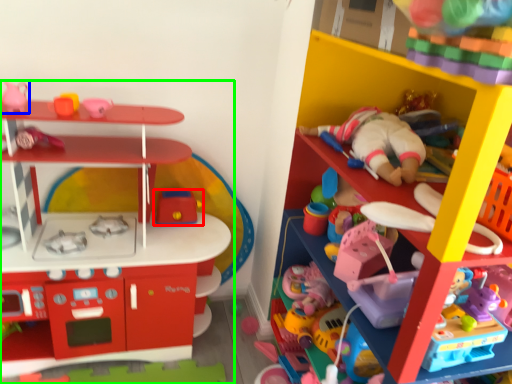
Question: Based on their relative distances, which object is nearer to toy (highlighted by a red box)? Choose from toy (highlighted by a blue box) and toy (highlighted by a green box).

Choices:
 (A) toy
 (B) toy

Answer: (B)